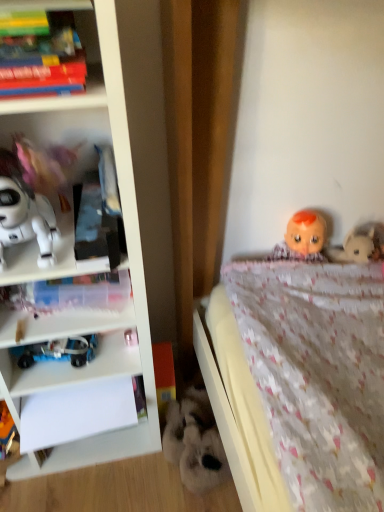
Question: Is fluffy white stuffed animal at lower center, acting as the 1th toy starting from the right, positioned far away from blue plastic toy at lower left, marked as the 2th toy in a left-to-right arrangement?

Choices:
 (A) no
 (B) yes

Answer: (A)

Question: Is fluffy white stuffed animal at lower center, acting as the 1th toy starting from the right, wider than blue plastic toy at lower left, arranged as the third toy when viewed from the right?

Choices:
 (A) yes
 (B) no

Answer: (A)

Question: Is fluffy white stuffed animal at lower center, acting as the 1th toy starting from the right, further to the viewer compared to blue plastic toy at lower left, marked as the 2th toy in a left-to-right arrangement?

Choices:
 (A) no
 (B) yes

Answer: (B)

Question: Is fluffy white stuffed animal at lower center, which is counted as the first toy, starting from the bottom, beside blue plastic toy at lower left, the 3th toy when ordered from top to bottom?

Choices:
 (A) yes
 (B) no

Answer: (B)

Question: From a real-world perspective, is fluffy white stuffed animal at lower center, placed as the 4th toy when sorted from top to bottom, positioned under blue plastic toy at lower left, arranged as the third toy when viewed from the right, based on gravity?

Choices:
 (A) no
 (B) yes

Answer: (B)

Question: Considering the relative sizes of fluffy white stuffed animal at lower center, placed as the 4th toy when sorted from top to bottom, and blue plastic toy at lower left, which is the 2th toy from bottom to top, in the image provided, is fluffy white stuffed animal at lower center, placed as the 4th toy when sorted from top to bottom, bigger than blue plastic toy at lower left, which is the 2th toy from bottom to top,?

Choices:
 (A) no
 (B) yes

Answer: (B)

Question: Is pink fabric doll at left, arranged as the fourth toy when ordered from the bottom, smaller than white matte robot at left, arranged as the 1th toy when viewed from the left?

Choices:
 (A) no
 (B) yes

Answer: (B)

Question: Considering the relative sizes of pink fabric doll at left, the second toy when ordered from right to left, and white matte robot at left, arranged as the 4th toy when viewed from the right, in the image provided, is pink fabric doll at left, the second toy when ordered from right to left, bigger than white matte robot at left, arranged as the 4th toy when viewed from the right,?

Choices:
 (A) yes
 (B) no

Answer: (B)

Question: Considering the relative positions of pink fabric doll at left, the second toy when ordered from right to left, and white matte robot at left, the 2th toy in the top-to-bottom sequence, in the image provided, is pink fabric doll at left, the second toy when ordered from right to left, in front of white matte robot at left, the 2th toy in the top-to-bottom sequence,?

Choices:
 (A) no
 (B) yes

Answer: (A)

Question: Is pink fabric doll at left, which ranks as the 1th toy in top-to-bottom order, wider than white matte robot at left, arranged as the 1th toy when viewed from the left?

Choices:
 (A) no
 (B) yes

Answer: (A)

Question: From a real-world perspective, is pink fabric doll at left, which is the 3th toy from left to right, below white matte robot at left, the third toy in the bottom-to-top sequence?

Choices:
 (A) no
 (B) yes

Answer: (A)

Question: From the image's perspective, is pink fabric doll at left, which is the 3th toy from left to right, below white matte robot at left, the third toy in the bottom-to-top sequence?

Choices:
 (A) no
 (B) yes

Answer: (A)

Question: Does white matte robot at left, the third toy in the bottom-to-top sequence, have a greater width compared to blue plastic toy at lower left, marked as the 2th toy in a left-to-right arrangement?

Choices:
 (A) no
 (B) yes

Answer: (B)